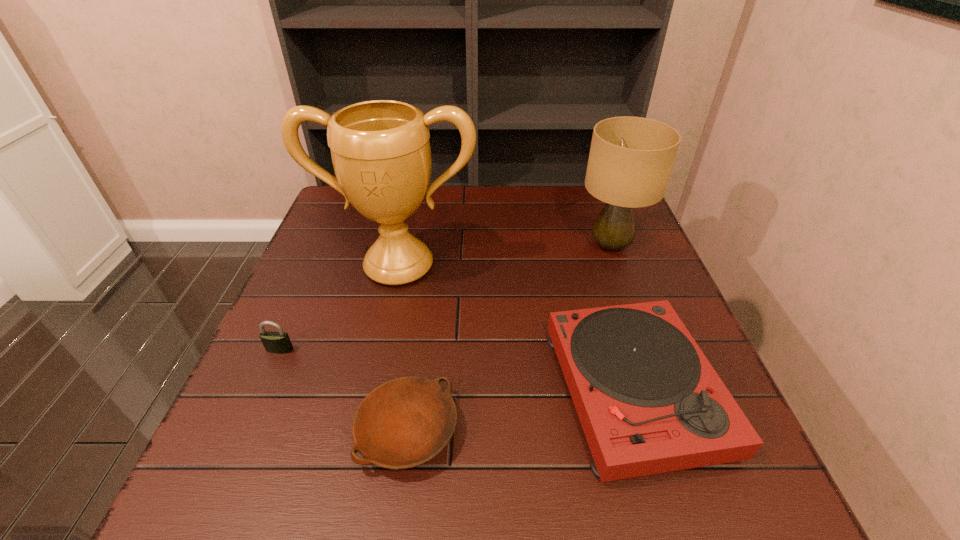
Identify the location of award. Image resolution: width=960 pixels, height=540 pixels. (381, 155).

Where is `the second tallest object`? This screenshot has width=960, height=540. the second tallest object is located at coordinates (631, 158).

Find the location of `record player`. record player is located at coordinates (649, 401).

Image resolution: width=960 pixels, height=540 pixels. Identify the location of padlock. (279, 342).

Where is `the shortest object`? The image size is (960, 540). the shortest object is located at coordinates (404, 422).

Where is `blank space located on the front of the tallest object with the decoration`? Image resolution: width=960 pixels, height=540 pixels. blank space located on the front of the tallest object with the decoration is located at coordinates (369, 405).

Where is `vacant space located 0.160m on the left of the lampshade`? vacant space located 0.160m on the left of the lampshade is located at coordinates (517, 246).

Locate an element on the screen. The width and height of the screenshot is (960, 540). vacant space situated on the left of the record player is located at coordinates pos(386,391).

Locate an element on the screen. This screenshot has width=960, height=540. vacant area located on the back of the padlock is located at coordinates (292, 321).

Where is `blank space located on the left of the shortest object`? blank space located on the left of the shortest object is located at coordinates (235, 430).